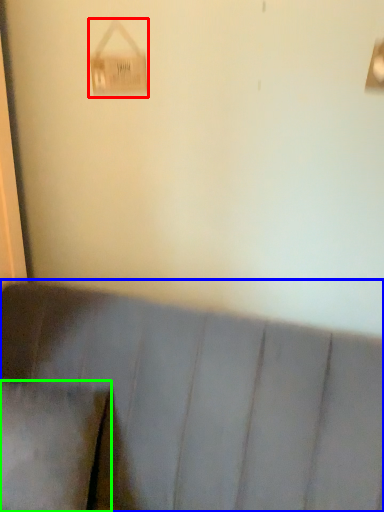
Question: Which object is the farthest from lamp (highlighted by a red box)? Choose among these: furniture (highlighted by a blue box) or pillow (highlighted by a green box).

Choices:
 (A) furniture
 (B) pillow

Answer: (B)